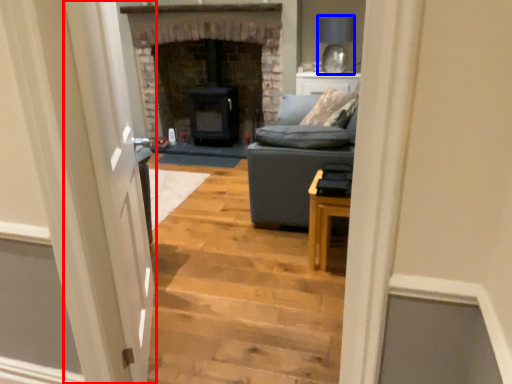
Question: Among these objects, which one is nearest to the camera, glass door (highlighted by a red box) or lamp (highlighted by a blue box)?

Choices:
 (A) glass door
 (B) lamp

Answer: (A)